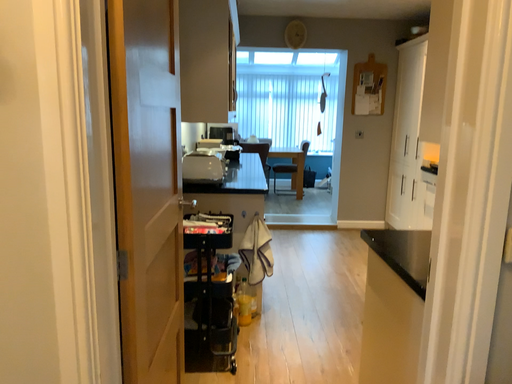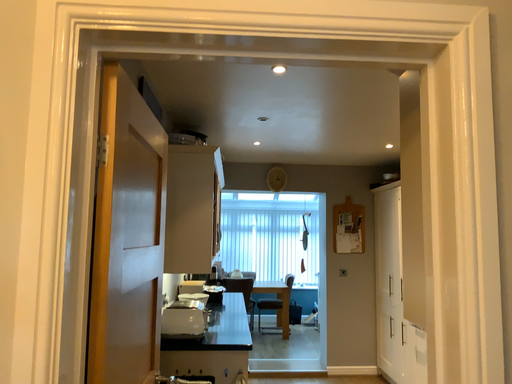
Question: How did the camera likely rotate when shooting the video?

Choices:
 (A) rotated upward
 (B) rotated downward

Answer: (A)